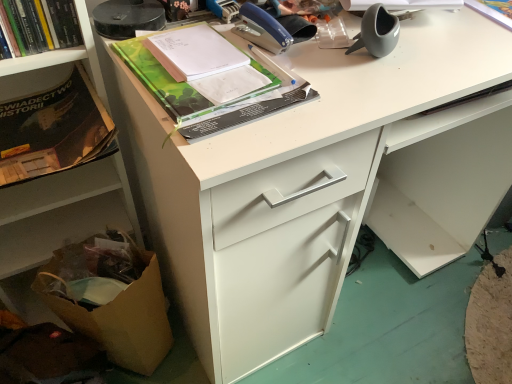
Question: Is green matte book at upper center, acting as the 2th book starting from the right, smaller than white paper at upper right, which is the first book from right to left?

Choices:
 (A) no
 (B) yes

Answer: (A)

Question: Does green matte book at upper center, the second book when ordered from left to right, appear on the left side of white paper at upper right, which is the first book from right to left?

Choices:
 (A) yes
 (B) no

Answer: (A)

Question: From a real-world perspective, is green matte book at upper center, acting as the 2th book starting from the right, physically below white paper at upper right, which is the first book from right to left?

Choices:
 (A) yes
 (B) no

Answer: (B)

Question: Is green matte book at upper center, acting as the 2th book starting from the right, looking in the opposite direction of white paper at upper right, which appears as the third book when viewed from the left?

Choices:
 (A) no
 (B) yes

Answer: (A)

Question: Does green matte book at upper center, acting as the 2th book starting from the right, have a lesser height compared to white paper at upper right, which is the first book from right to left?

Choices:
 (A) no
 (B) yes

Answer: (A)

Question: From a real-world perspective, is brown paper bag at lower left above or below matte black book at left?

Choices:
 (A) above
 (B) below

Answer: (B)

Question: From the image's perspective, is brown paper bag at lower left located above or below matte black book at left?

Choices:
 (A) below
 (B) above

Answer: (A)

Question: Is point (51, 263) positioned closer to the camera than point (69, 120)?

Choices:
 (A) closer
 (B) farther

Answer: (B)

Question: In terms of size, does brown paper bag at lower left appear bigger or smaller than matte black book at left?

Choices:
 (A) small
 (B) big

Answer: (B)

Question: From the image's perspective, is green matte book at upper center, the second book when ordered from left to right, above or below brown cardboard box at lower left?

Choices:
 (A) below
 (B) above

Answer: (B)

Question: In terms of size, does green matte book at upper center, acting as the 2th book starting from the right, appear bigger or smaller than brown cardboard box at lower left?

Choices:
 (A) small
 (B) big

Answer: (A)

Question: In the image, is green matte book at upper center, the second book when ordered from left to right, on the left side or the right side of brown cardboard box at lower left?

Choices:
 (A) right
 (B) left

Answer: (A)

Question: Do you think green matte book at upper center, the second book when ordered from left to right, is within brown cardboard box at lower left, or outside of it?

Choices:
 (A) inside
 (B) outside

Answer: (B)

Question: Considering the positions of matte gray vase at upper right, the 1th office supplies positioned from the right, and hardcover book at upper left, the third book positioned from the right, in the image, is matte gray vase at upper right, the 1th office supplies positioned from the right, bigger or smaller than hardcover book at upper left, the third book positioned from the right,?

Choices:
 (A) big
 (B) small

Answer: (B)

Question: From a real-world perspective, is matte gray vase at upper right, which is the 2th office supplies in left-to-right order, positioned above or below hardcover book at upper left, the third book positioned from the right?

Choices:
 (A) above
 (B) below

Answer: (B)